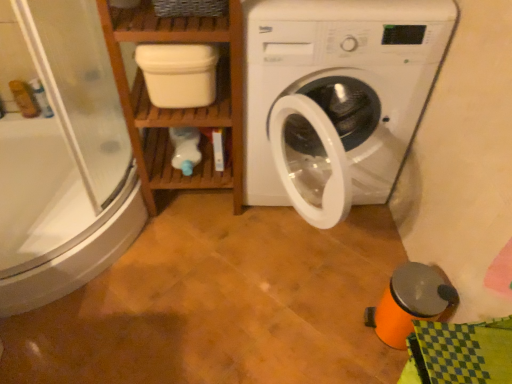
I want to click on free space in front of white plastic washing machine at center, so click(263, 332).